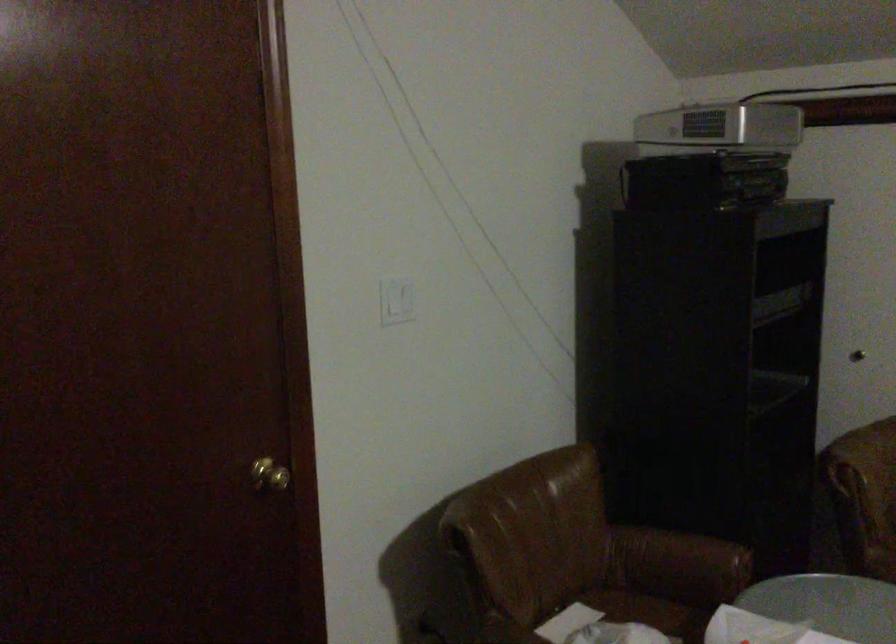
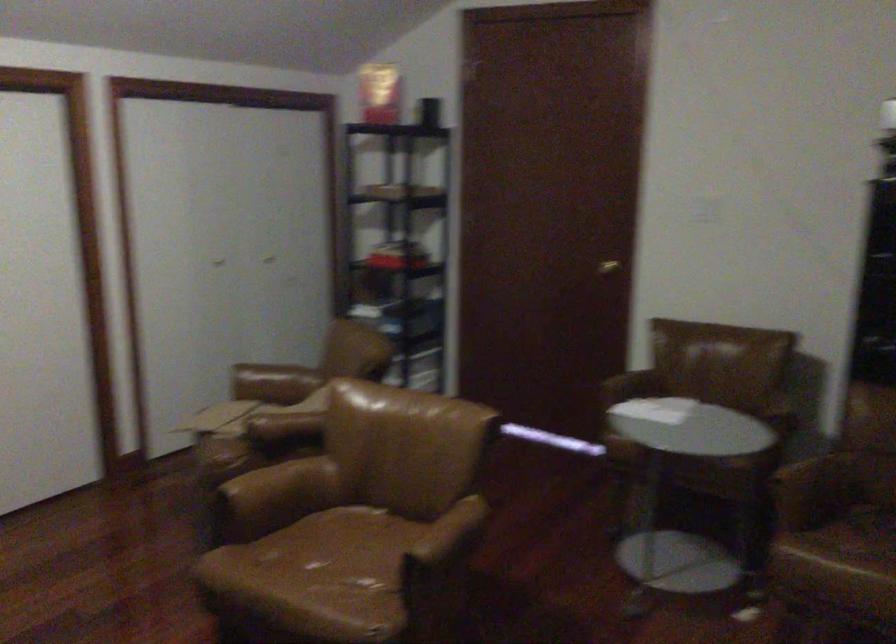
In the second image, find the point that corresponds to pixel 243 505 in the first image.

(607, 267)